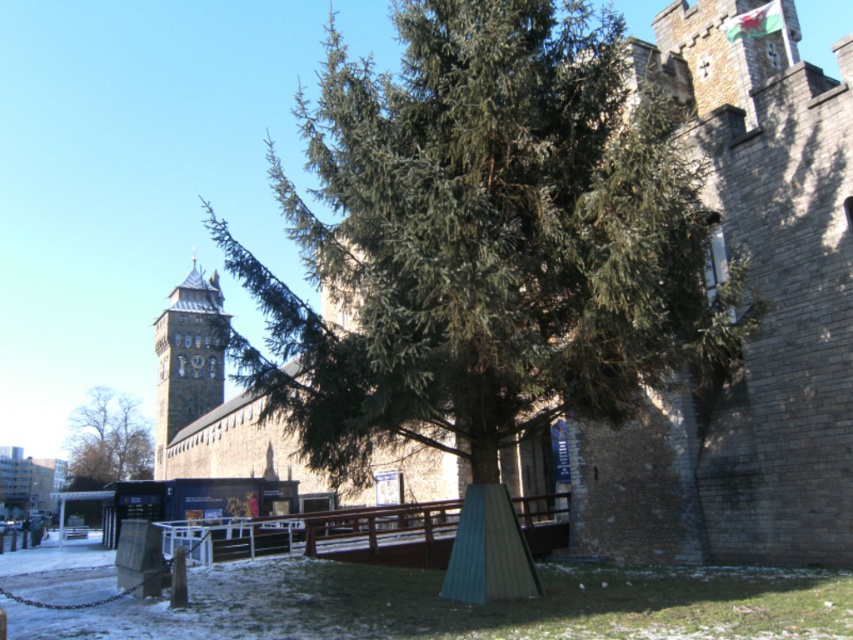
Question: Which object is closer to the camera taking this photo?

Choices:
 (A) stone clock tower at center-left
 (B) brown leafy tree at left

Answer: (A)

Question: Can you confirm if stone clock tower at center-left is positioned to the right of brown leafy tree at left?

Choices:
 (A) yes
 (B) no

Answer: (A)

Question: Is stone clock tower at center-left to the left of brown leafy tree at left from the viewer's perspective?

Choices:
 (A) no
 (B) yes

Answer: (A)

Question: Which point is closer to the camera?

Choices:
 (A) (196, 356)
 (B) (74, 467)

Answer: (A)

Question: Does stone clock tower at center-left have a lesser width compared to brown leafy tree at left?

Choices:
 (A) yes
 (B) no

Answer: (B)

Question: Which of the following is the farthest from the observer?

Choices:
 (A) brown leafy tree at left
 (B) stone clock tower at center-left

Answer: (A)